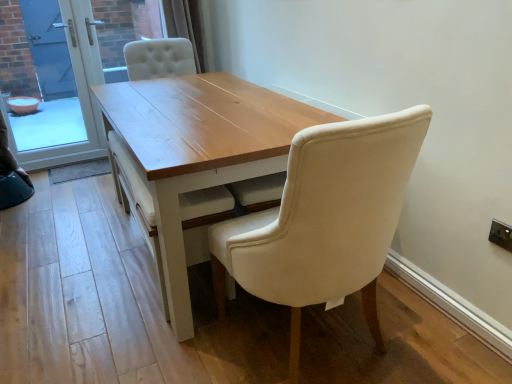
Locate an element on the screen. This screenshot has height=384, width=512. free spot to the right of matte cream chair at center is located at coordinates (421, 337).